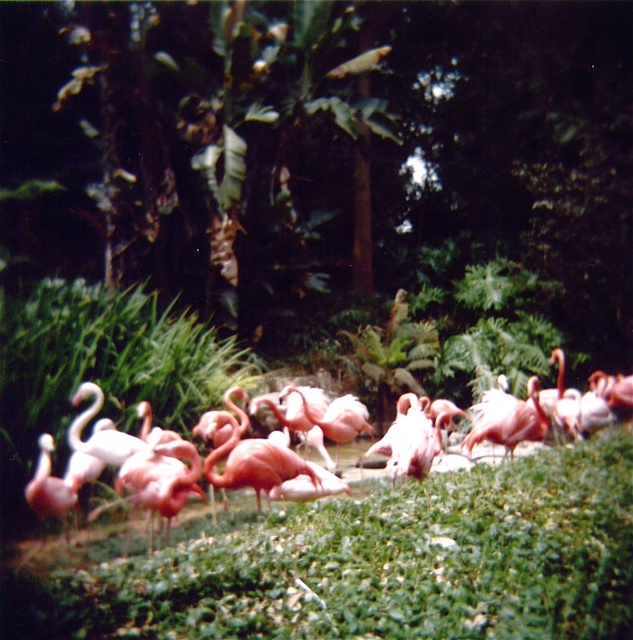
Question: Is pink matte flamingo at center further to camera compared to pink matte flamingo at lower left?

Choices:
 (A) no
 (B) yes

Answer: (B)

Question: Which object is the closest to the pink matte flamingo at lower left?

Choices:
 (A) pink matte flamingo at center
 (B) green leafy grass at center

Answer: (B)

Question: Which object appears closest to the camera in this image?

Choices:
 (A) pink matte flamingo at center
 (B) green leafy grass at center
 (C) pink matte flamingo at lower left

Answer: (B)

Question: Does pink matte flamingo at center lie in front of pink matte flamingo at lower left?

Choices:
 (A) yes
 (B) no

Answer: (B)

Question: Where is green leafy grass at center located in relation to pink matte flamingo at center in the image?

Choices:
 (A) right
 (B) left

Answer: (B)

Question: Based on their relative distances, which object is farther from the green leafy grass at center?

Choices:
 (A) pink matte flamingo at center
 (B) pink matte flamingo at lower left

Answer: (B)